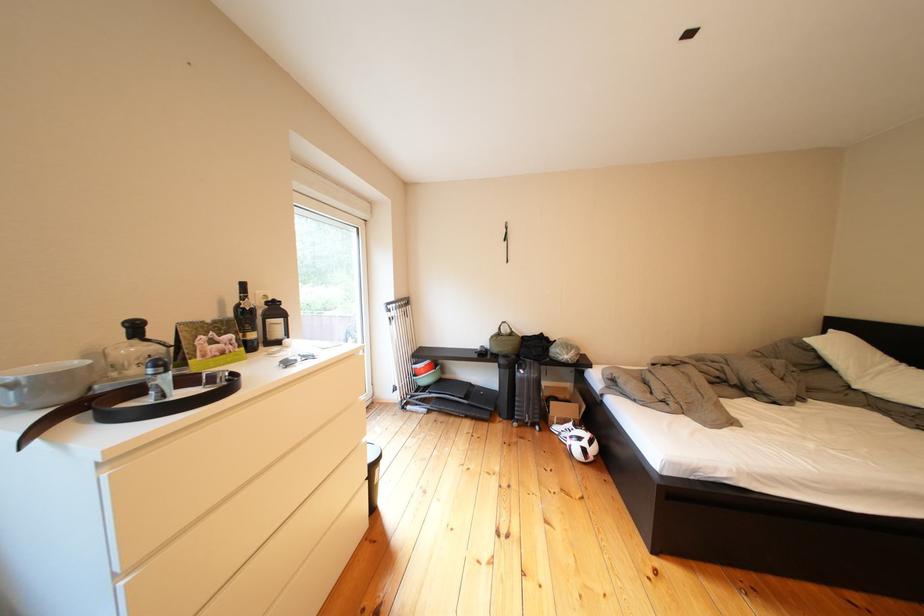
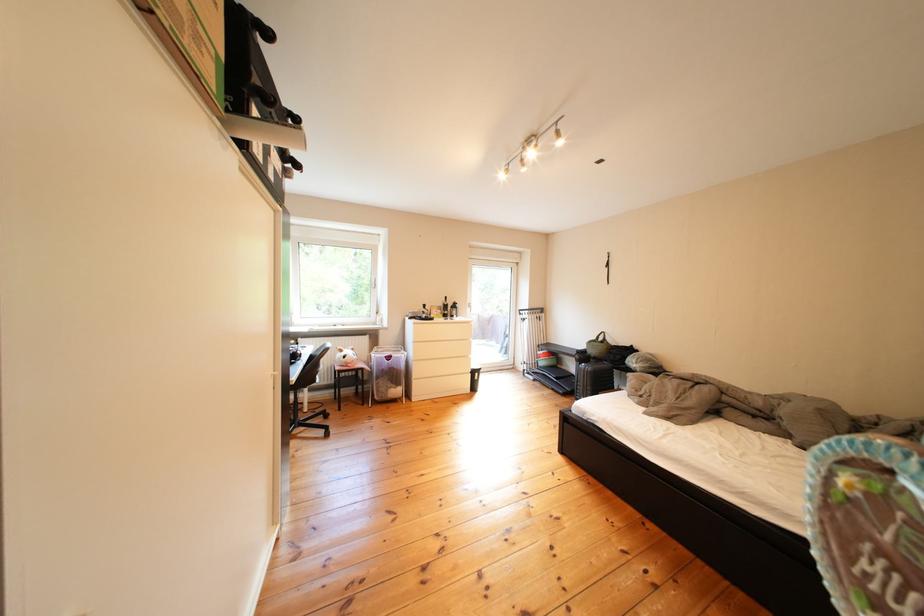
Locate, in the second image, the point that corresponds to (x=462, y=381) in the first image.

(578, 371)